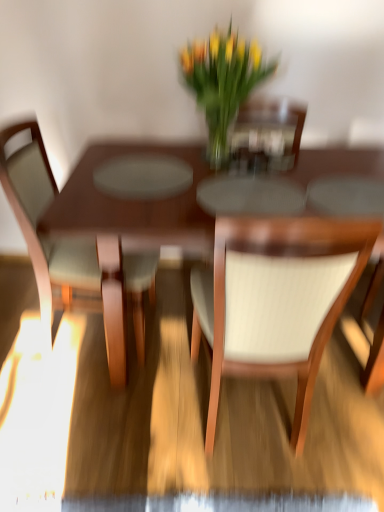
Where is `vacant area that lies between white textured chair at center, which appears as the second chair when viewed from the left, and light brown wood chair at left, marked as the first chair in a left-to-right arrangement`? vacant area that lies between white textured chair at center, which appears as the second chair when viewed from the left, and light brown wood chair at left, marked as the first chair in a left-to-right arrangement is located at coordinates (143, 392).